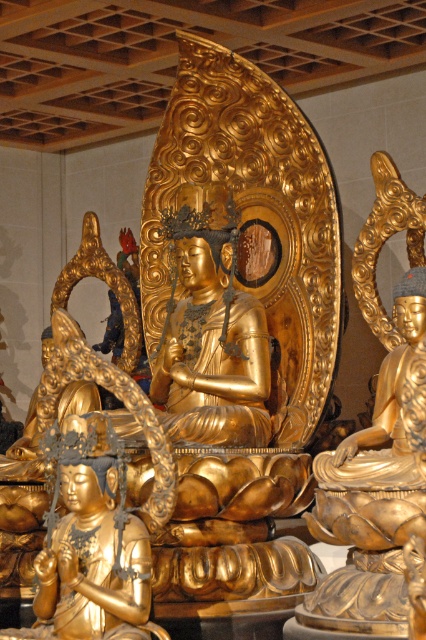
You are a temple visitor who wants to take a photo of the gold polished statue at right. The temple has a rule that you must stand exactly at point (376, 445) to take the photo. However, there is a golden Buddhist altar at that point. Can you take the photo without moving the altar?

The point (376, 445) is where the gold polished statue at right is located, so you cannot take the photo there without moving the statue.